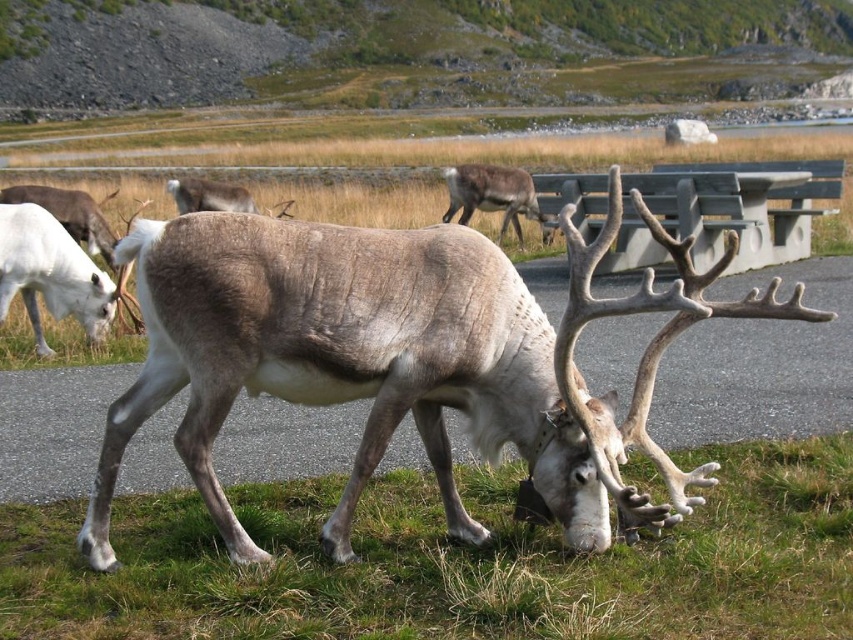
Based on the photo, you are a wildlife photographer observing the scene. You notice two reindeer at the center of the image. Which one is closer to the camera, the brown fur antlered deer at center or the brown fur reindeer at center?

The brown fur antlered deer at center is closer to the camera because it is positioned under the brown fur reindeer at center, indicating it is in front.

You are standing at the center of the image and want to find the green grass at lower right. Which direction should you look to see it?

The green grass at lower right is located at point (450, 563), so you should look to your lower right direction to see it.